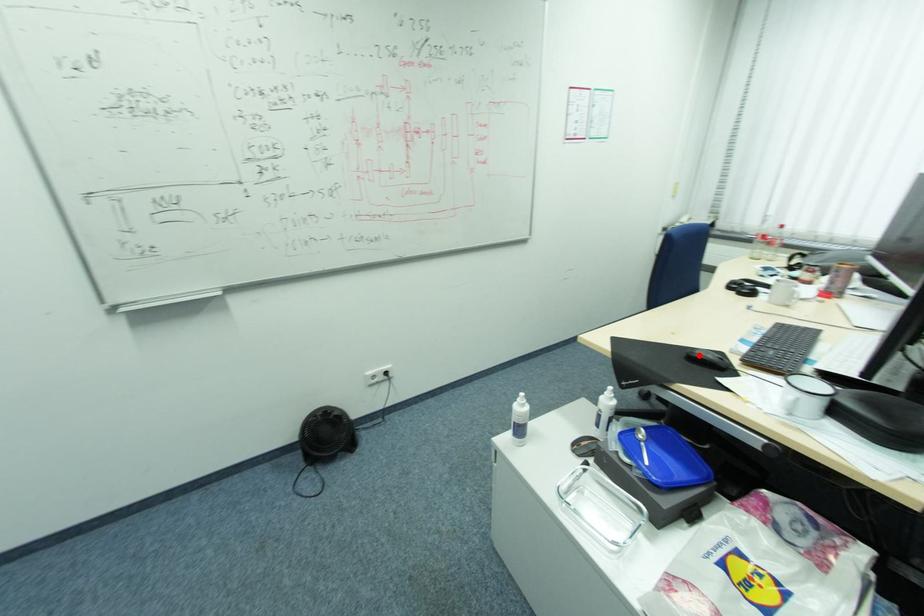
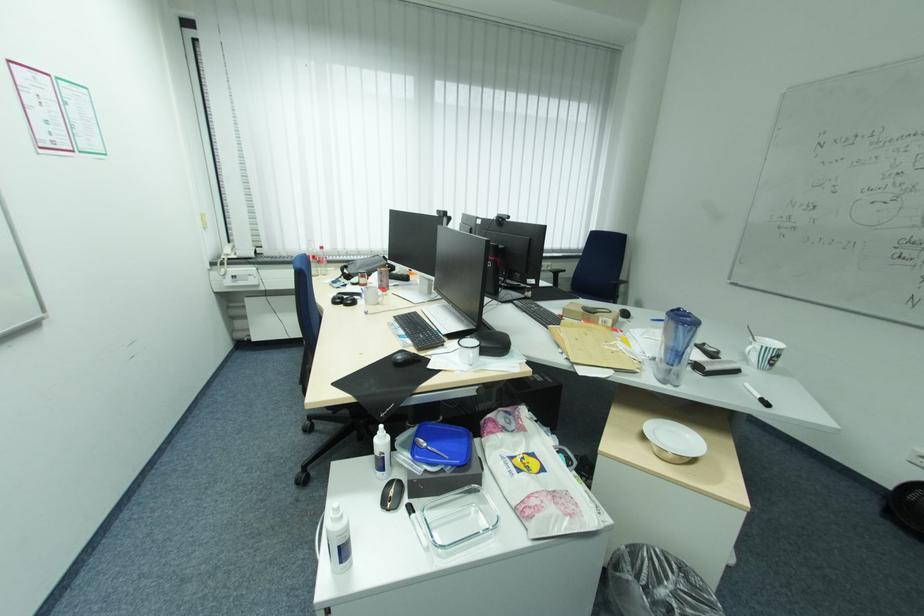
Find the pixel in the second image that matches the highlighted location in the first image.

(406, 361)